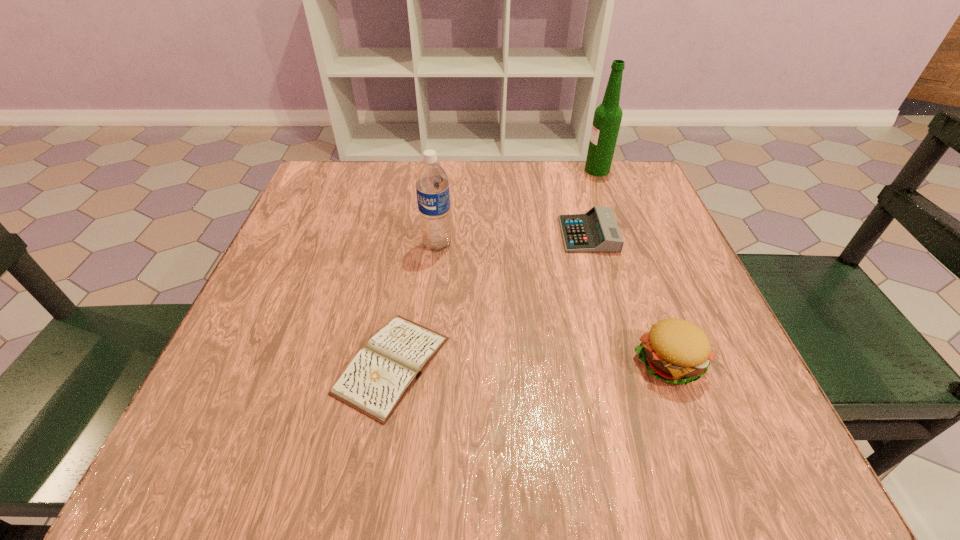
At what (x,y) coordinates should I click in order to perform the action: click on the farthest object. Please return your answer as a coordinate pair (x, y). This screenshot has width=960, height=540. Looking at the image, I should click on (607, 118).

What are the coordinates of `beer bottle` in the screenshot? It's located at (607, 118).

Image resolution: width=960 pixels, height=540 pixels. Find the location of `water bottle`. water bottle is located at coordinates (432, 187).

This screenshot has height=540, width=960. I want to click on hamburger, so click(676, 351).

Find the location of a particular element. calculator is located at coordinates (595, 231).

This screenshot has width=960, height=540. I want to click on the shortest object, so click(x=379, y=376).

The width and height of the screenshot is (960, 540). I want to click on vacant space located 0.340m on the label of the beer bottle, so click(453, 170).

Where is `free location located 0.080m on the label of the beer bottle`? The image size is (960, 540). free location located 0.080m on the label of the beer bottle is located at coordinates (554, 170).

The width and height of the screenshot is (960, 540). In order to click on free space located 0.260m on the label of the beer bottle in this screenshot , I will do `click(484, 170)`.

Find the location of a particular element. The image size is (960, 540). vacant region located on the back of the water bottle is located at coordinates (444, 180).